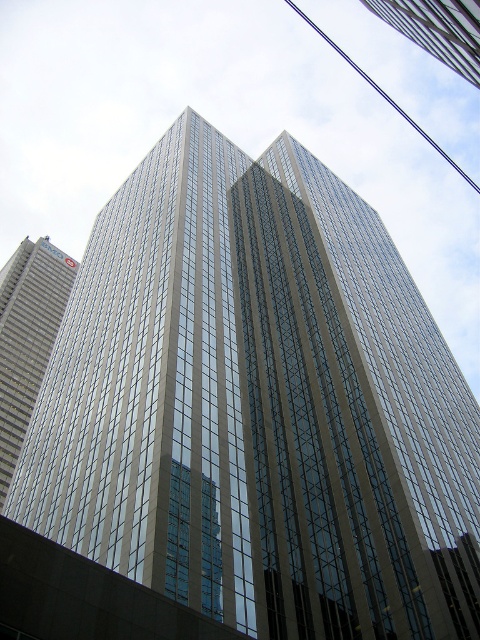
You are a drone operator tasked with flying a drone between the silver metallic skyscraper at left and the transparent glass skyscraper at upper center. The drone has a maximum flight distance of 100 meters. Based on the scene, can the drone safely complete this task without exceeding its range?

The distance between the silver metallic skyscraper at left and the transparent glass skyscraper at upper center is 108.89 meters, which exceeds the drone operator has a maximum flight distance of 100 meters. Therefore, the drone cannot safely complete this task without exceeding its range.

You are an architect examining the image of the skyscraper. You notice the transparent glass skyscraper at upper center and the blue wire at upper center. Which object is positioned higher in the image?

The blue wire at upper center is positioned higher than the transparent glass skyscraper at upper center since the skyscraper is located below it.